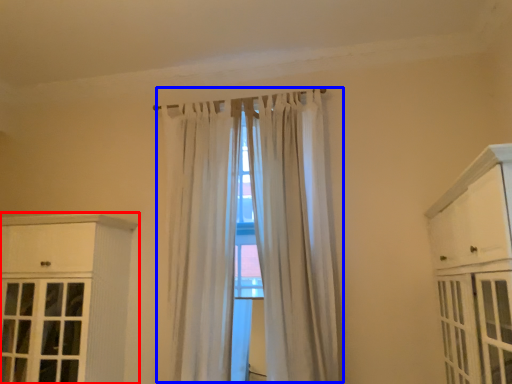
Question: Which object is closer to the camera taking this photo, cabinetry (highlighted by a red box) or curtain (highlighted by a blue box)?

Choices:
 (A) cabinetry
 (B) curtain

Answer: (A)